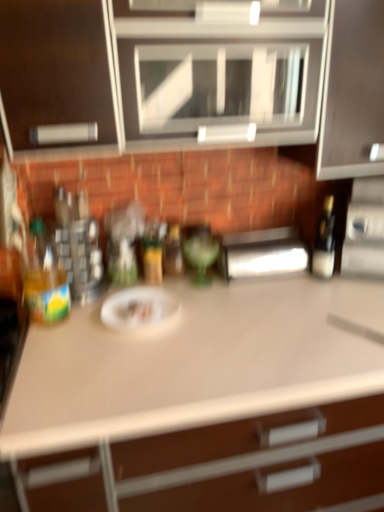
Question: Is green glass bottle at center, which appears as the 3th bottle when viewed from the left, located within translucent glass bottle at center, which is the 2th bottle from left to right?

Choices:
 (A) yes
 (B) no

Answer: (B)

Question: Considering the relative sizes of translucent glass bottle at center, which is the 2th bottle from left to right, and green glass bottle at center, which appears as the 3th bottle when viewed from the left, in the image provided, is translucent glass bottle at center, which is the 2th bottle from left to right, shorter than green glass bottle at center, which appears as the 3th bottle when viewed from the left,?

Choices:
 (A) no
 (B) yes

Answer: (B)

Question: Are translucent glass bottle at center, which is counted as the 3th bottle, starting from the right, and green glass bottle at center, which appears as the 3th bottle when viewed from the left, located far from each other?

Choices:
 (A) yes
 (B) no

Answer: (B)

Question: Is the position of translucent glass bottle at center, which is the 2th bottle from left to right, more distant than that of green glass bottle at center, which appears as the 3th bottle when viewed from the left?

Choices:
 (A) no
 (B) yes

Answer: (B)

Question: Is translucent glass bottle at center, which is counted as the 3th bottle, starting from the right, at the left side of green glass bottle at center, the 2th bottle positioned from the right?

Choices:
 (A) yes
 (B) no

Answer: (A)

Question: Is translucent glass bottle at center, which is counted as the 3th bottle, starting from the right, in front of green glass bottle at center, which appears as the 3th bottle when viewed from the left?

Choices:
 (A) no
 (B) yes

Answer: (A)

Question: Is white matte countertop at center located outside translucent plastic bottle at left, positioned as the 1th bottle in left-to-right order?

Choices:
 (A) yes
 (B) no

Answer: (A)

Question: Is white matte countertop at center wider than translucent plastic bottle at left, which appears as the 4th bottle when viewed from the right?

Choices:
 (A) no
 (B) yes

Answer: (B)

Question: Is white matte countertop at center positioned in front of translucent plastic bottle at left, positioned as the 1th bottle in left-to-right order?

Choices:
 (A) yes
 (B) no

Answer: (A)

Question: Is white matte countertop at center positioned behind translucent plastic bottle at left, positioned as the 1th bottle in left-to-right order?

Choices:
 (A) no
 (B) yes

Answer: (A)

Question: Is translucent plastic bottle at left, which appears as the 4th bottle when viewed from the right, surrounded by white matte countertop at center?

Choices:
 (A) yes
 (B) no

Answer: (B)

Question: From a real-world perspective, does white matte countertop at center sit lower than translucent plastic bottle at left, which appears as the 4th bottle when viewed from the right?

Choices:
 (A) no
 (B) yes

Answer: (B)

Question: Is there a large distance between matte black bottle at right, positioned as the fourth bottle in left-to-right order, and satin silver paper towel dispenser at center, the 2th appliance positioned from the right?

Choices:
 (A) yes
 (B) no

Answer: (B)